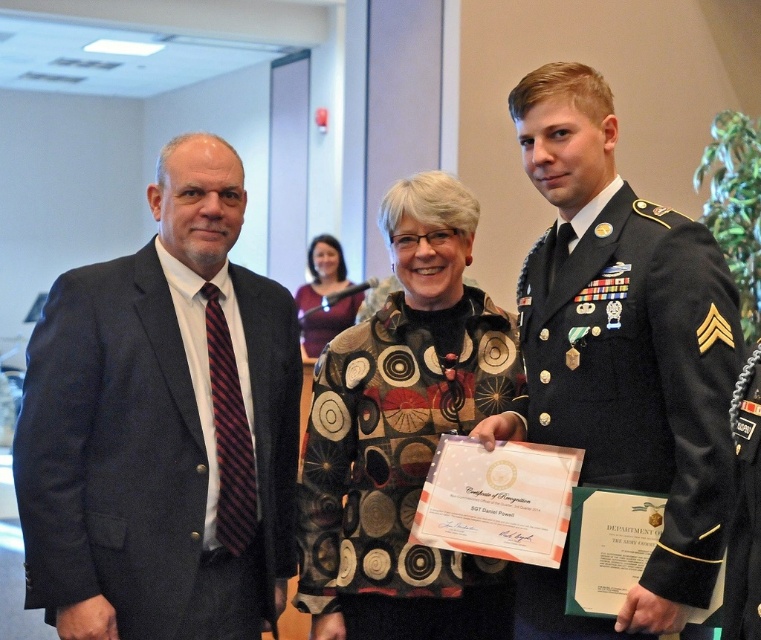
You are standing at the point labeled point (231,228) and want to take a photo of the three individuals in the scene. If your camera has a focal length of 50 mm and you want to ensure that the entire group fits within the frame, which has a width of 36 mm, what is the minimum distance you should maintain from the group to capture them all?

The point labeled point (231,228) is 2.62 meters away from the camera. To ensure the entire group fits within the frame width of 36 mm using a 50 mm focal length, the minimum distance should be calculated using the formula distance > focal length multiplied by subject width divided by frame width. However, without knowing the actual width of the group, an exact calculation isn

In the scene shown: You are standing at point (27,596) and want to take a photo of the camera. Can you reach the camera from your current position if you can move 2.5 meters forward?

The distance between point (27,596) and the camera is 2.42 meters. Since you can move 2.5 meters forward, you can reach the camera.